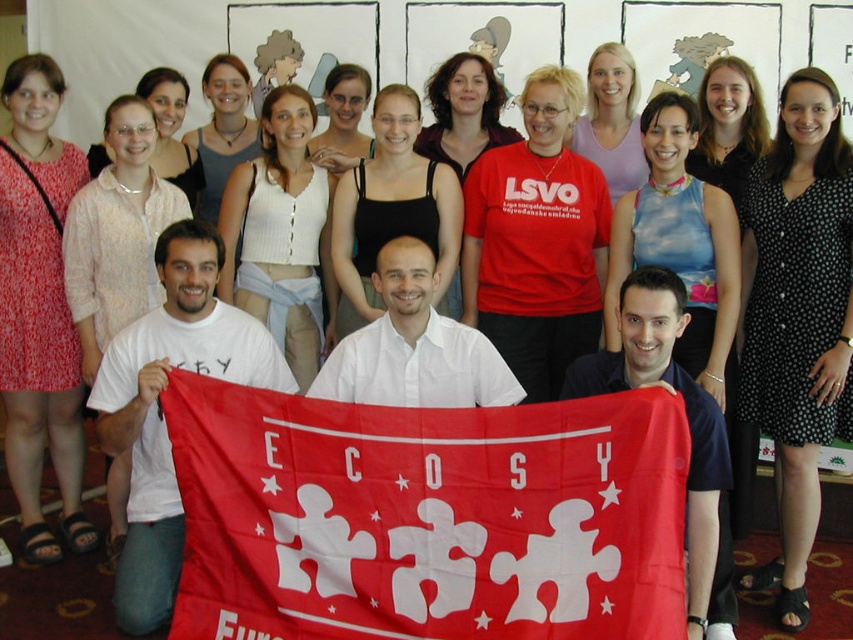
Is point (364, 570) behind point (167, 99)?

No, (364, 570) is closer to viewer.

Image resolution: width=853 pixels, height=640 pixels. I want to click on red fabric flag at center, so click(x=427, y=516).

Identify the location of red fabric flag at center. (427, 516).

Which is below, matte red t-shirt at center or white knit tank top at center?

white knit tank top at center

Is point (608, 227) in front of point (247, 188)?

Yes, it is.

This screenshot has height=640, width=853. What are the coordinates of `matte red t-shirt at center` in the screenshot? It's located at (537, 241).

Which is in front, point (798, 580) or point (229, 262)?

Positioned in front is point (798, 580).

Identify the location of black dotted dress at upper right. The width and height of the screenshot is (853, 640). (798, 316).

Between point (773, 381) and point (293, 164), which one is positioned behind?

Point (293, 164)

At what (x,y) coordinates should I click in order to perform the action: click on black dotted dress at upper right. Please return your answer as a coordinate pair (x, y). The width and height of the screenshot is (853, 640). Looking at the image, I should click on (798, 316).